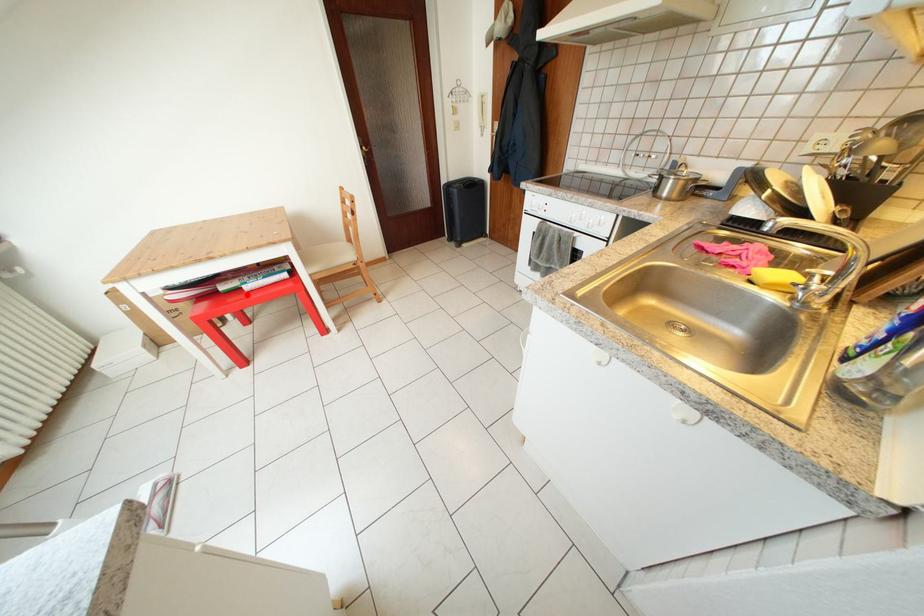
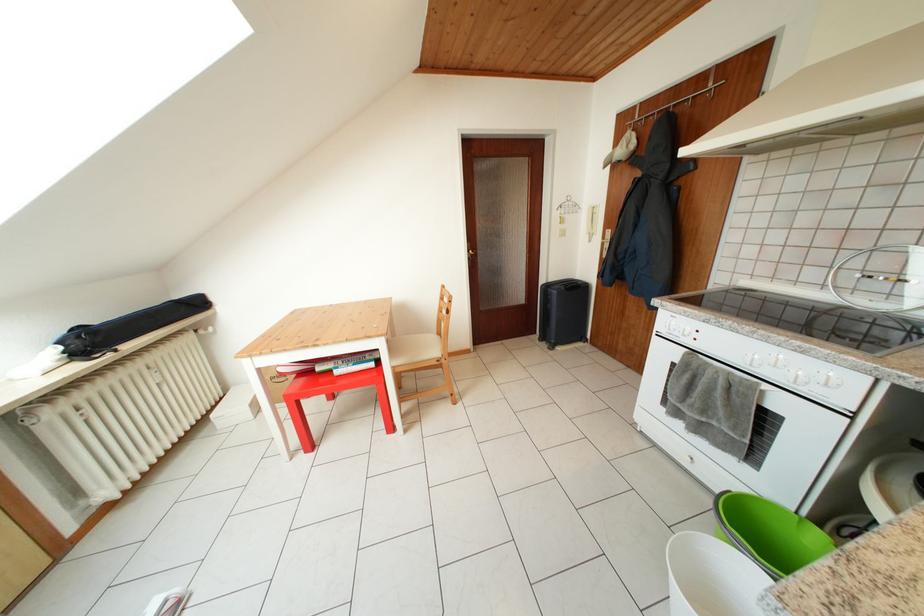
Question: I am providing you with two images of the same scene from different viewpoints. A red point is marked on the first image. Is the red point's position out of view in image 2?

Choices:
 (A) Yes
 (B) No

Answer: (B)